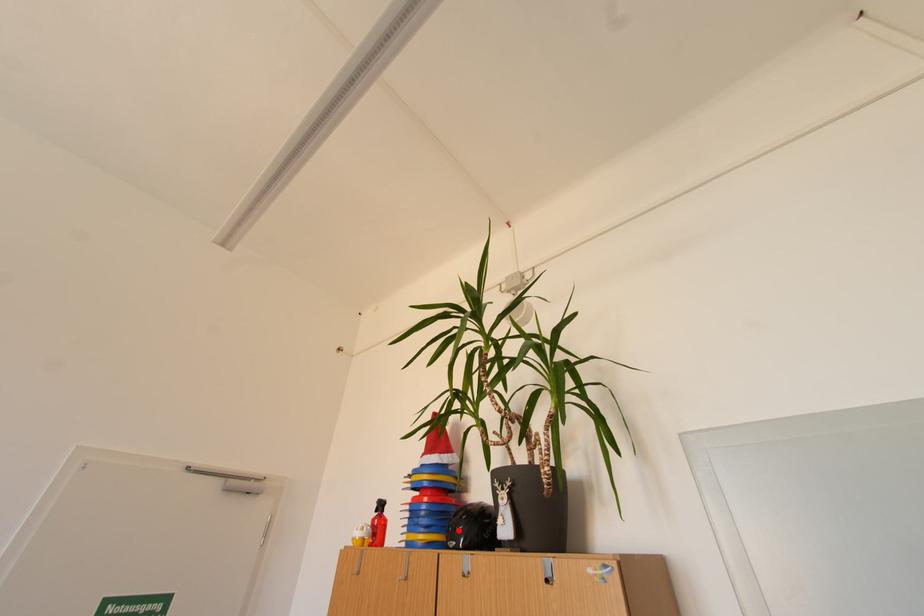
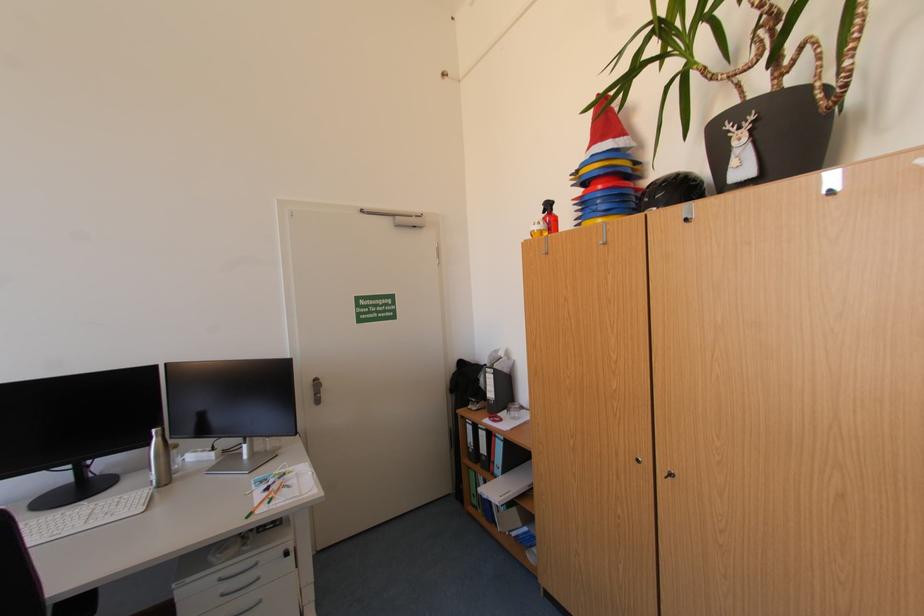
Where in the second image is the point corresponding to the highlighted location from the first image?

(654, 201)